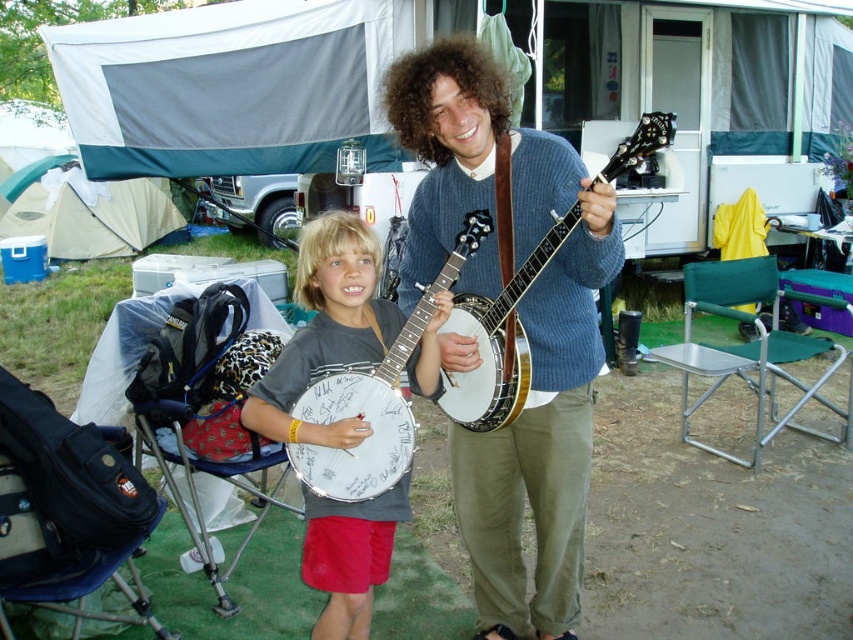
Question: Can you confirm if blue knitted sweater at center is positioned to the right of green fabric folding chair at lower right?

Choices:
 (A) no
 (B) yes

Answer: (A)

Question: Observing the image, what is the correct spatial positioning of white wooden banjo at center in reference to white wood banjo at center?

Choices:
 (A) above
 (B) below

Answer: (B)

Question: Which of the following is the farthest from the observer?

Choices:
 (A) white wood banjo at center
 (B) blue fabric folding chair at lower left

Answer: (B)

Question: Which point is farther to the camera?

Choices:
 (A) (395, 465)
 (B) (711, 282)

Answer: (B)

Question: Which point is farther to the camera?

Choices:
 (A) green fabric folding chair at lower right
 (B) white wooden banjo at center

Answer: (A)

Question: Is blue knitted sweater at center smaller than green fabric folding chair at lower right?

Choices:
 (A) yes
 (B) no

Answer: (A)